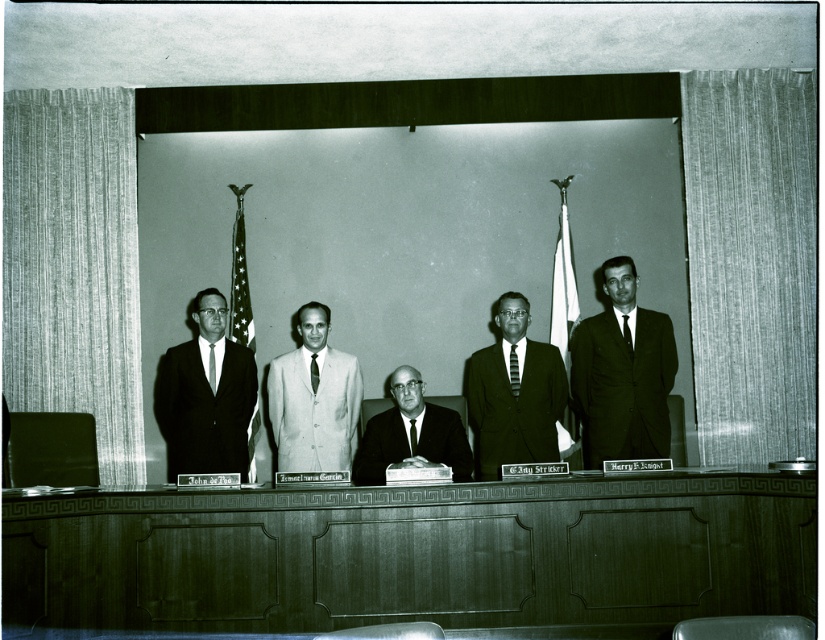
You are standing at the back of the conference room. You see two points marked on the table in front of you. The first point is at coordinate point (x=644, y=458) and the second point is at coordinate point (x=347, y=403). Which point is closer to you?

Point (x=347, y=403) is closer to you because it is behind point (x=644, y=458). Since you are at the back of the room, the point further back on the table would be nearer to your position.

In the photograph, there is a long wooden table with nameplates including John de Toi, Ismael Garcia, and E.Jay Stricker. You notice a point marked at coordinates [621,372]. What object is located at this point?

The dark green suit at right is located at point [621,372].